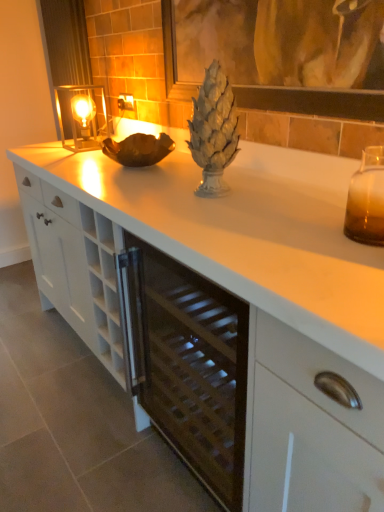
Identify the location of metallic silver curtain at upper left. (66, 41).

Image resolution: width=384 pixels, height=512 pixels. Describe the element at coordinates (309, 426) in the screenshot. I see `white matte cabinet at center` at that location.

At what (x,y) coordinates should I click in order to perform the action: click on metallic glass candle holder at left, arranged as the 2th candle holder when ordered from the bottom. Please return your answer as a coordinate pair (x, y). The image size is (384, 512). Looking at the image, I should click on (81, 116).

Describe the element at coordinates (367, 199) in the screenshot. I see `amber glass vase at right, placed as the first candle holder when sorted from right to left` at that location.

At what (x,y) coordinates should I click in order to perform the action: click on metallic silver curtain at upper left. Please return your answer as a coordinate pair (x, y). Looking at the image, I should click on [x=66, y=41].

Where is `curtain above the shiny metallic pineapple at center (from the image's perspective)`? curtain above the shiny metallic pineapple at center (from the image's perspective) is located at coordinates (66, 41).

Does point (216, 81) come behind point (71, 79)?

No, (216, 81) is in front of (71, 79).

How distant is shiny metallic pineapple at center from metallic silver curtain at upper left?

The distance of shiny metallic pineapple at center from metallic silver curtain at upper left is 1.57 meters.

Which object is positioned more to the right, shiny metallic pineapple at center or amber glass vase at right, the 1th candle holder positioned from the front?

amber glass vase at right, the 1th candle holder positioned from the front, is more to the right.

Based on the photo, does shiny metallic pineapple at center contain amber glass vase at right, the 1th candle holder in the bottom-to-top sequence?

No, amber glass vase at right, the 1th candle holder in the bottom-to-top sequence, is not a part of shiny metallic pineapple at center.

Is shiny metallic pineapple at center directly adjacent to amber glass vase at right, which is the second candle holder from back to front?

No, shiny metallic pineapple at center is not with amber glass vase at right, which is the second candle holder from back to front.

Which object is more forward, shiny metallic pineapple at center or amber glass vase at right, which is the second candle holder from back to front?

amber glass vase at right, which is the second candle holder from back to front, is closer to the camera.

Which is behind, white matte cabinet at center or metallic silver curtain at upper left?

metallic silver curtain at upper left is behind.

Is white matte cabinet at center far from metallic silver curtain at upper left?

Yes.

Is white matte cabinet at center bigger than metallic silver curtain at upper left?

Yes.

From a real-world perspective, is white matte cabinet at center above or below metallic silver curtain at upper left?

white matte cabinet at center is situated lower than metallic silver curtain at upper left in the real world.

This screenshot has height=512, width=384. I want to click on candle holder that is the 1st one when counting rightward from the metallic silver curtain at upper left, so click(x=81, y=116).

Can you confirm if metallic silver curtain at upper left is taller than metallic glass candle holder at left, the first candle holder viewed from the left?

Yes, metallic silver curtain at upper left is taller than metallic glass candle holder at left, the first candle holder viewed from the left.

From the picture: Is metallic silver curtain at upper left in contact with metallic glass candle holder at left, arranged as the 2th candle holder when ordered from the bottom?

There is a gap between metallic silver curtain at upper left and metallic glass candle holder at left, arranged as the 2th candle holder when ordered from the bottom.

Looking at this image, how many degrees apart are the facing directions of metallic silver curtain at upper left and metallic glass candle holder at left, the second candle holder when ordered from front to back?

The angle between the facing direction of metallic silver curtain at upper left and the facing direction of metallic glass candle holder at left, the second candle holder when ordered from front to back, is 0.00146 degrees.

Between amber glass vase at right, which appears as the 2th candle holder when viewed from the top, and metallic silver curtain at upper left, which one is positioned in front?

Positioned in front is amber glass vase at right, which appears as the 2th candle holder when viewed from the top.

Is amber glass vase at right, the 1th candle holder in the bottom-to-top sequence, inside the boundaries of metallic silver curtain at upper left, or outside?

amber glass vase at right, the 1th candle holder in the bottom-to-top sequence, is outside metallic silver curtain at upper left.

Measure the distance from amber glass vase at right, placed as the 2th candle holder when sorted from left to right, to metallic silver curtain at upper left.

The distance of amber glass vase at right, placed as the 2th candle holder when sorted from left to right, from metallic silver curtain at upper left is 1.94 meters.

Looking at this image, which object is positioned more to the right, white matte cabinet at center or amber glass vase at right, the 1th candle holder in the bottom-to-top sequence?

Positioned to the right is white matte cabinet at center.

From a real-world perspective, is white matte cabinet at center positioned above or below amber glass vase at right, which appears as the 2th candle holder when viewed from the top?

In terms of real-world spatial position, white matte cabinet at center is below amber glass vase at right, which appears as the 2th candle holder when viewed from the top.

Between white matte cabinet at center and amber glass vase at right, the 1th candle holder in the bottom-to-top sequence, which one has smaller size?

Smaller between the two is amber glass vase at right, the 1th candle holder in the bottom-to-top sequence.

Which of these two, white matte cabinet at center or amber glass vase at right, which is the second candle holder from back to front, is thinner?

amber glass vase at right, which is the second candle holder from back to front, is thinner.

Is metallic glass candle holder at left, the second candle holder when ordered from front to back, facing away from amber glass vase at right, the 1th candle holder in the bottom-to-top sequence?

No, metallic glass candle holder at left, the second candle holder when ordered from front to back,'s orientation is not away from amber glass vase at right, the 1th candle holder in the bottom-to-top sequence.

Based on the photo, from a real-world perspective, which is physically above, metallic glass candle holder at left, which is counted as the first candle holder, starting from the back, or amber glass vase at right, which is the second candle holder from back to front?

metallic glass candle holder at left, which is counted as the first candle holder, starting from the back.

Can you confirm if metallic glass candle holder at left, the first candle holder viewed from the left, is smaller than amber glass vase at right, the 1th candle holder positioned from the front?

Actually, metallic glass candle holder at left, the first candle holder viewed from the left, might be larger than amber glass vase at right, the 1th candle holder positioned from the front.

From the image's perspective, is metallic glass candle holder at left, the first candle holder from the top, below amber glass vase at right, the 1th candle holder positioned from the front?

No, from the image's perspective, metallic glass candle holder at left, the first candle holder from the top, is not beneath amber glass vase at right, the 1th candle holder positioned from the front.

Where is `curtain located above the shiny metallic pineapple at center (from the image's perspective)`? curtain located above the shiny metallic pineapple at center (from the image's perspective) is located at coordinates (66, 41).

The image size is (384, 512). What are the coordinates of `pineapple lying on the left of amber glass vase at right, placed as the first candle holder when sorted from right to left` in the screenshot? It's located at (213, 131).

From the image, which object appears to be farther from metallic glass candle holder at left, which is counted as the first candle holder, starting from the back, white matte cabinet at center or shiny metallic pineapple at center?

white matte cabinet at center is further to metallic glass candle holder at left, which is counted as the first candle holder, starting from the back.

Based on their spatial positions, is white matte countertop at center or metallic silver curtain at upper left further from white matte cabinet at center?

metallic silver curtain at upper left.

Estimate the real-world distances between objects in this image. Which object is closer to shiny metallic pineapple at center, amber glass vase at right, placed as the 2th candle holder when sorted from left to right, or matte glass picture frame at upper center?

Based on the image, matte glass picture frame at upper center appears to be nearer to shiny metallic pineapple at center.

When comparing their distances from white matte countertop at center, does amber glass vase at right, the 1th candle holder positioned from the front, or matte glass picture frame at upper center seem further?

matte glass picture frame at upper center is further to white matte countertop at center.

When comparing their distances from metallic silver curtain at upper left, does metallic glass candle holder at left, which is counted as the first candle holder, starting from the back, or matte glass picture frame at upper center seem further?

Based on the image, matte glass picture frame at upper center appears to be further to metallic silver curtain at upper left.

From the image, which object appears to be nearer to matte glass picture frame at upper center, white matte countertop at center or shiny metallic pineapple at center?

Among the two, shiny metallic pineapple at center is located nearer to matte glass picture frame at upper center.

Considering their positions, is matte glass picture frame at upper center positioned closer to metallic silver curtain at upper left than white matte countertop at center?

white matte countertop at center is positioned closer to the anchor metallic silver curtain at upper left.

Which object lies further to the anchor point white matte countertop at center, shiny metallic pineapple at center or matte glass picture frame at upper center?

The object further to white matte countertop at center is matte glass picture frame at upper center.

Where is `picture frame located between white matte cabinet at center and metallic silver curtain at upper left in the depth direction`? Image resolution: width=384 pixels, height=512 pixels. picture frame located between white matte cabinet at center and metallic silver curtain at upper left in the depth direction is located at coordinates tap(313, 102).

Locate an element on the screen. The width and height of the screenshot is (384, 512). pineapple that lies between metallic silver curtain at upper left and white matte countertop at center from top to bottom is located at coordinates [x=213, y=131].

The width and height of the screenshot is (384, 512). What are the coordinates of `countertop between shiny metallic pineapple at center and white matte cabinet at center vertically` in the screenshot? It's located at (238, 296).

Identify the location of candle holder between shiny metallic pineapple at center and metallic silver curtain at upper left in the front-back direction. The image size is (384, 512). (81, 116).